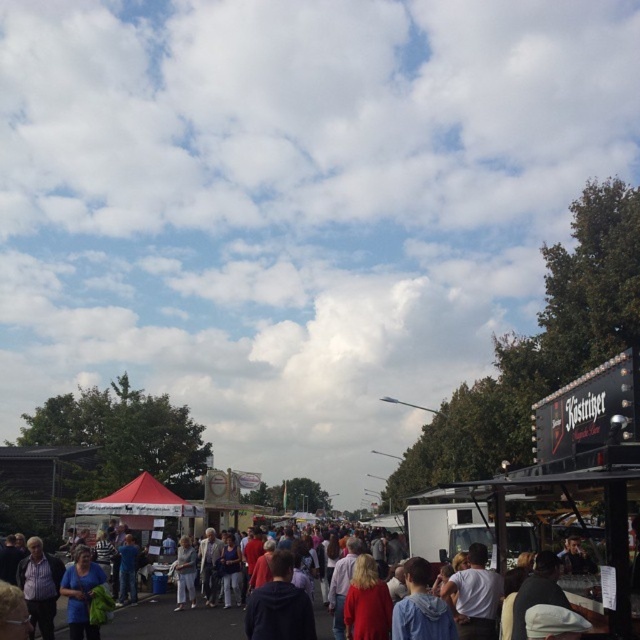
Who is positioned more to the left, dark blue hoodie at center or blue cotton shirt at lower left?

From the viewer's perspective, blue cotton shirt at lower left appears more on the left side.

Can you confirm if dark blue hoodie at center is positioned to the left of blue cotton shirt at lower left?

Incorrect, dark blue hoodie at center is not on the left side of blue cotton shirt at lower left.

Who is more forward, (310, 609) or (74, 595)?

Positioned in front is point (310, 609).

At what (x,y) coordinates should I click in order to perform the action: click on dark blue hoodie at center. Please return your answer as a coordinate pair (x, y). This screenshot has width=640, height=640. Looking at the image, I should click on (280, 605).

Which is behind, point (330, 620) or point (264, 582)?

The point (330, 620) is more distant.

Does point (138, 612) come behind point (310, 636)?

Yes, point (138, 612) is behind point (310, 636).

Does point (232, 616) come in front of point (300, 605)?

That is False.

Identify the location of matte blue hoodie at center. (173, 621).

Can you confirm if matte blue hoodie at center is positioned to the left of blue cotton shirt at lower left?

In fact, matte blue hoodie at center is to the right of blue cotton shirt at lower left.

Based on the photo, is matte blue hoodie at center behind blue cotton shirt at lower left?

That is True.

Identify the location of matte blue hoodie at center. (173, 621).